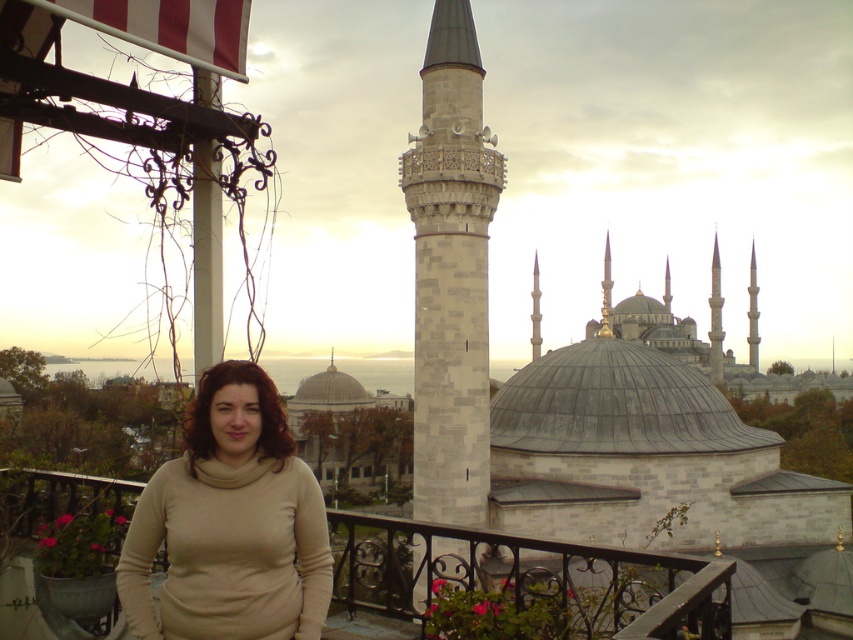
Consider the image. You are a fashion designer observing the beige turtleneck sweater at center and the black wrought iron railing at lower center in the image. Which object takes up less space in the scene?

The beige turtleneck sweater at center has a smaller size compared to the black wrought iron railing at lower center, so it takes up less space in the scene.

Looking at this image, you are standing on the balcony and want to take a photo of the white marble minaret at center and the metallic wrought iron at left. Which object should you frame first in your camera viewfinder to ensure both are in the shot?

You should frame the metallic wrought iron at left first because the white marble minaret at center is to the right of it, so starting with the leftmost object ensures both are included in the photo.

You are a drone operator trying to capture the white marble minaret at center in a photo. The camera is currently positioned at point A, which is at coordinates 0.3, 0.5. To frame the minaret perfectly, should you adjust the camera position to the left or right along the horizontal axis?

The white marble minaret at center is located at point (451, 273). Since the camera is at (426, 192), which is to the left of the minaret, you should move the camera position to the right along the horizontal axis to center it.